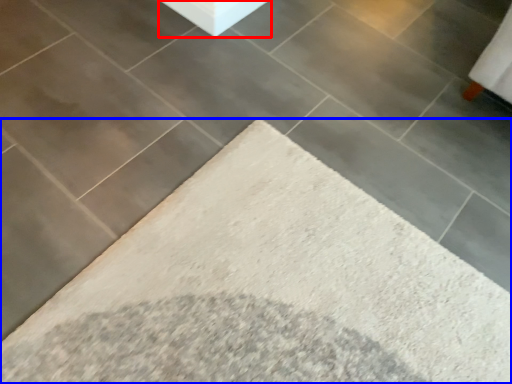
Question: Which of the following is the closest to the observer, concrete (highlighted by a red box) or furniture (highlighted by a blue box)?

Choices:
 (A) concrete
 (B) furniture

Answer: (B)